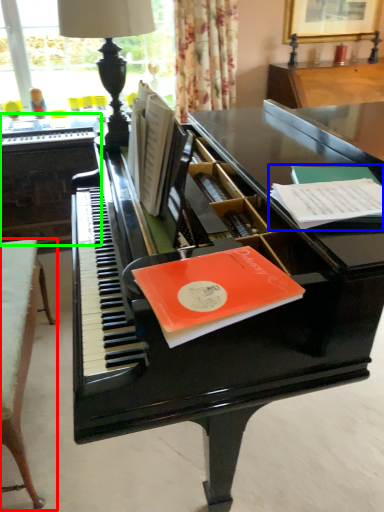
Question: Based on their relative distances, which object is nearer to table (highlighted by a red box)? Choose from paperback book (highlighted by a blue box) and table (highlighted by a green box).

Choices:
 (A) paperback book
 (B) table

Answer: (B)